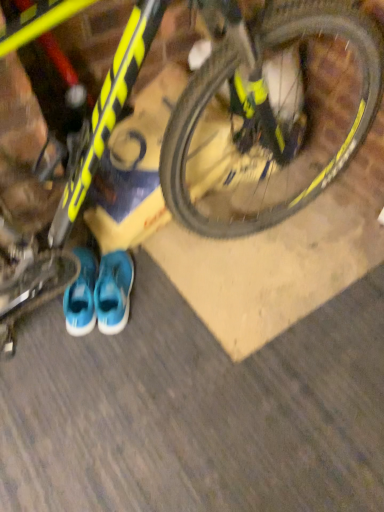
The height and width of the screenshot is (512, 384). Describe the element at coordinates (260, 123) in the screenshot. I see `yellow matte bicycle at upper center` at that location.

Locate an element on the screen. Image resolution: width=384 pixels, height=512 pixels. blue fabric sneakers at lower center is located at coordinates (81, 296).

Is blue fabric running shoe at lower center to the right of blue fabric sneakers at lower center from the viewer's perspective?

Indeed, blue fabric running shoe at lower center is positioned on the right side of blue fabric sneakers at lower center.

Considering the relative sizes of blue fabric running shoe at lower center and blue fabric sneakers at lower center in the image provided, is blue fabric running shoe at lower center smaller than blue fabric sneakers at lower center?

Incorrect, blue fabric running shoe at lower center is not smaller in size than blue fabric sneakers at lower center.

Considering the sizes of objects blue fabric running shoe at lower center and blue fabric sneakers at lower center in the image provided, who is shorter, blue fabric running shoe at lower center or blue fabric sneakers at lower center?

Standing shorter between the two is blue fabric sneakers at lower center.

Is the depth of blue fabric running shoe at lower center less than that of blue fabric sneakers at lower center?

Yes, it is.

Is yellow matte bicycle at upper center wider or thinner than blue fabric sneakers at lower center?

yellow matte bicycle at upper center is wider than blue fabric sneakers at lower center.

From the image's perspective, is yellow matte bicycle at upper center positioned above or below blue fabric sneakers at lower center?

yellow matte bicycle at upper center is below blue fabric sneakers at lower center.

Considering the sizes of objects yellow matte bicycle at upper center and blue fabric sneakers at lower center in the image provided, who is taller, yellow matte bicycle at upper center or blue fabric sneakers at lower center?

With more height is blue fabric sneakers at lower center.

Is point (355, 305) farther from viewer compared to point (69, 305)?

Yes, it is.

From a real-world perspective, is blue fabric running shoe at lower center below yellow matte bicycle at upper center?

Correct, in the physical world, blue fabric running shoe at lower center is lower than yellow matte bicycle at upper center.

Would you say blue fabric running shoe at lower center is a long distance from yellow matte bicycle at upper center?

They are positioned close to each other.

Measure the distance between blue fabric running shoe at lower center and yellow matte bicycle at upper center.

A distance of 19.84 inches exists between blue fabric running shoe at lower center and yellow matte bicycle at upper center.

In terms of size, does blue fabric running shoe at lower center appear bigger or smaller than yellow matte bicycle at upper center?

Considering their sizes, blue fabric running shoe at lower center takes up less space than yellow matte bicycle at upper center.

Considering the relative positions of yellow matte bicycle at upper center and blue fabric sneakers at lower center in the image provided, is yellow matte bicycle at upper center behind blue fabric sneakers at lower center?

No, it is in front of blue fabric sneakers at lower center.

Identify the location of footwear that is under the yellow matte bicycle at upper center (from a real-world perspective). (81, 296).

Is yellow matte bicycle at upper center facing away from blue fabric sneakers at lower center?

yellow matte bicycle at upper center is not turned away from blue fabric sneakers at lower center.

From a real-world perspective, which object rests below the other?

yellow matte bicycle at upper center.

Would you say yellow matte bicycle at upper center is a long distance from yellow matte bicycle at upper center?

No, yellow matte bicycle at upper center is in close proximity to yellow matte bicycle at upper center.

Looking at this image, who is more distant, yellow matte bicycle at upper center or yellow matte bicycle at upper center?

yellow matte bicycle at upper center is more distant.

Is point (174, 358) closer to camera compared to point (131, 284)?

Yes, point (174, 358) is closer to viewer.

Is yellow matte bicycle at upper center aimed at blue fabric running shoe at lower center?

No.

From the image's perspective, does yellow matte bicycle at upper center appear higher than blue fabric running shoe at lower center?

Incorrect, from the image's perspective, yellow matte bicycle at upper center is lower than blue fabric running shoe at lower center.

Which of these two, blue fabric running shoe at lower center or yellow matte bicycle at upper center, is smaller?

blue fabric running shoe at lower center.

Could you measure the distance between blue fabric running shoe at lower center and yellow matte bicycle at upper center?

blue fabric running shoe at lower center and yellow matte bicycle at upper center are 13.21 inches apart.

From the image's perspective, is blue fabric running shoe at lower center located above or below yellow matte bicycle at upper center?

Based on their image positions, blue fabric running shoe at lower center is located above yellow matte bicycle at upper center.

Locate an element on the screen. Image resolution: width=384 pixels, height=512 pixels. running shoe that appears on the left of yellow matte bicycle at upper center is located at coordinates (113, 292).

Image resolution: width=384 pixels, height=512 pixels. Identify the location of footwear behind the blue fabric running shoe at lower center. tap(81, 296).

This screenshot has width=384, height=512. Identify the location of dirt track below the blue fabric sneakers at lower center (from the image's perspective). (196, 411).

When comparing their distances from blue fabric running shoe at lower center, does yellow matte bicycle at upper center or blue fabric sneakers at lower center seem closer?

blue fabric sneakers at lower center.

When comparing their distances from yellow matte bicycle at upper center, does blue fabric running shoe at lower center or blue fabric sneakers at lower center seem further?

blue fabric sneakers at lower center is further to yellow matte bicycle at upper center.

Which object lies nearer to the anchor point blue fabric sneakers at lower center, blue fabric running shoe at lower center or yellow matte bicycle at upper center?

The object closer to blue fabric sneakers at lower center is blue fabric running shoe at lower center.

Which object lies nearer to the anchor point blue fabric sneakers at lower center, yellow matte bicycle at upper center or blue fabric running shoe at lower center?

A: blue fabric running shoe at lower center is positioned closer to the anchor blue fabric sneakers at lower center.

Which object lies further to the anchor point blue fabric running shoe at lower center, blue fabric sneakers at lower center or yellow matte bicycle at upper center?

The object further to blue fabric running shoe at lower center is yellow matte bicycle at upper center.

Consider the image. Based on their spatial positions, is blue fabric sneakers at lower center or blue fabric running shoe at lower center further from yellow matte bicycle at upper center?

Based on the image, blue fabric sneakers at lower center appears to be further to yellow matte bicycle at upper center.

Estimate the real-world distances between objects in this image. Which object is further from yellow matte bicycle at upper center, blue fabric running shoe at lower center or yellow matte bicycle at upper center?

blue fabric running shoe at lower center is positioned further to the anchor yellow matte bicycle at upper center.

Consider the image. Based on their spatial positions, is blue fabric sneakers at lower center or yellow matte bicycle at upper center further from yellow matte bicycle at upper center?

blue fabric sneakers at lower center lies further to yellow matte bicycle at upper center than the other object.

Locate an element on the screen. This screenshot has width=384, height=512. running shoe between blue fabric sneakers at lower center and yellow matte bicycle at upper center in the horizontal direction is located at coordinates (113, 292).

Where is `running shoe between yellow matte bicycle at upper center and blue fabric sneakers at lower center along the z-axis`? The image size is (384, 512). running shoe between yellow matte bicycle at upper center and blue fabric sneakers at lower center along the z-axis is located at coordinates tap(113, 292).

The image size is (384, 512). I want to click on dirt track between yellow matte bicycle at upper center and blue fabric running shoe at lower center in the front-back direction, so click(196, 411).

This screenshot has height=512, width=384. Find the location of `dirt track between yellow matte bicycle at upper center and blue fabric sneakers at lower center from front to back`. dirt track between yellow matte bicycle at upper center and blue fabric sneakers at lower center from front to back is located at coordinates (196, 411).